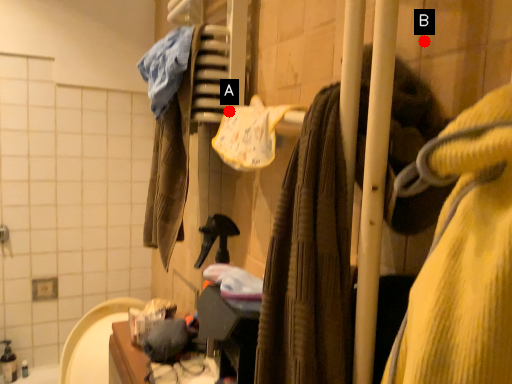
Question: Two points are circled on the image, labeled by A and B beside each circle. Among these points, which one is nearest to the camera?

Choices:
 (A) A is closer
 (B) B is closer

Answer: (B)